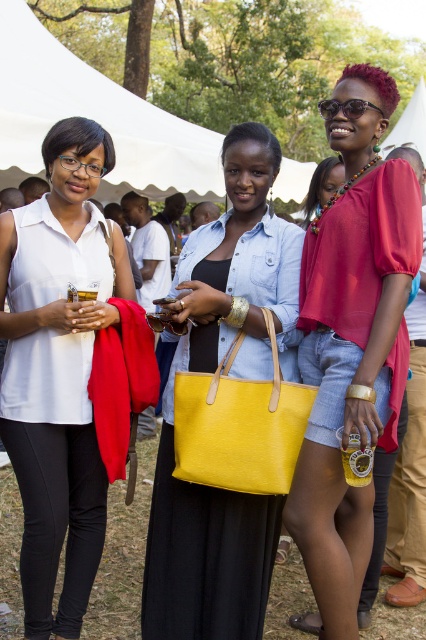
Question: Is white matte shirt at center smaller than matte yellow tote bag at center?

Choices:
 (A) no
 (B) yes

Answer: (B)

Question: Which point is farther from the camera taking this photo?

Choices:
 (A) (241, 424)
 (B) (293, 186)
 (C) (334, 448)

Answer: (B)

Question: From the image, what is the correct spatial relationship of matte yellow tote bag at center in relation to yellow leather tote at center?

Choices:
 (A) left
 (B) right

Answer: (A)

Question: Is matte red blouse at center in front of white fabric canopy at upper center?

Choices:
 (A) no
 (B) yes

Answer: (B)

Question: Which object appears closest to the camera in this image?

Choices:
 (A) matte red blouse at center
 (B) white matte shirt at center

Answer: (A)

Question: Which of the following is the farthest from the observer?

Choices:
 (A) (184, 346)
 (B) (268, 396)
 (C) (85, 396)
 (D) (357, 637)

Answer: (A)